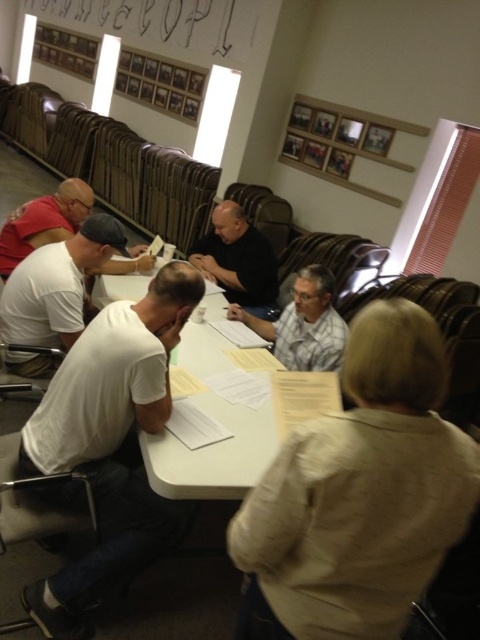
Is black matte shirt at center to the right of white matte shirt at left from the viewer's perspective?

Correct, you'll find black matte shirt at center to the right of white matte shirt at left.

Consider the image. Which is more to the right, black matte shirt at center or white matte shirt at left?

From the viewer's perspective, black matte shirt at center appears more on the right side.

Is point (239, 243) closer to camera compared to point (2, 253)?

No, it is not.

At what (x,y) coordinates should I click in order to perform the action: click on black matte shirt at center. Please return your answer as a coordinate pair (x, y). The width and height of the screenshot is (480, 640). Looking at the image, I should click on (239, 260).

What do you see at coordinates (302, 324) in the screenshot? This screenshot has height=640, width=480. I see `gray fabric shirt at center` at bounding box center [302, 324].

Looking at this image, does gray fabric shirt at center have a lesser width compared to black matte shirt at center?

Yes.

Identify the location of gray fabric shirt at center. This screenshot has width=480, height=640. (302, 324).

Is gray fabric shirt at center behind white matte shirt at left?

No, gray fabric shirt at center is closer to the viewer.

Does gray fabric shirt at center appear on the left side of white matte shirt at left?

In fact, gray fabric shirt at center is to the right of white matte shirt at left.

Is point (307, 301) closer to viewer compared to point (50, 240)?

Yes.

This screenshot has width=480, height=640. In order to click on gray fabric shirt at center in this screenshot , I will do `click(302, 324)`.